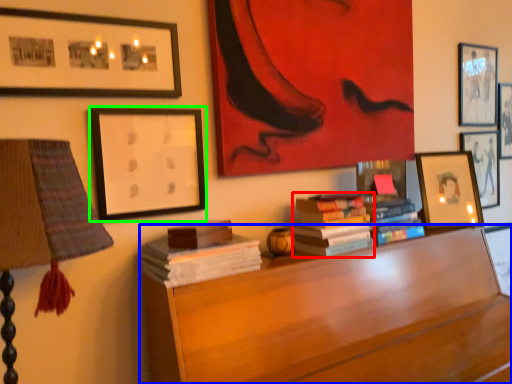
Question: Which object is the closest to the book (highlighted by a red box)? Choose among these: furniture (highlighted by a blue box) or picture frame (highlighted by a green box).

Choices:
 (A) furniture
 (B) picture frame

Answer: (A)